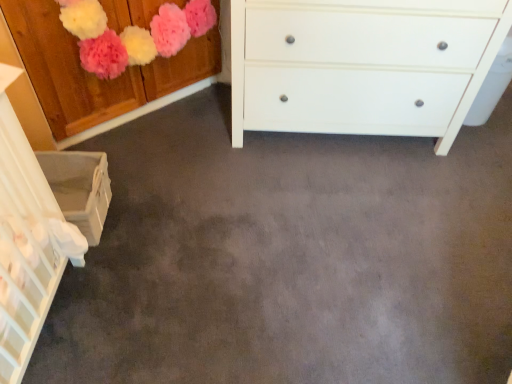
The image size is (512, 384). Identify the location of vacant area located to the right-hand side of white woven basket at lower left, which is the 2th cabinetry from top to bottom. (151, 221).